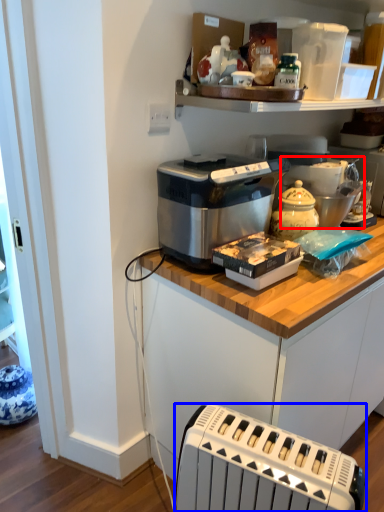
Question: Among these objects, which one is nearest to the camera, appliance (highlighted by a red box) or toaster (highlighted by a blue box)?

Choices:
 (A) appliance
 (B) toaster

Answer: (B)